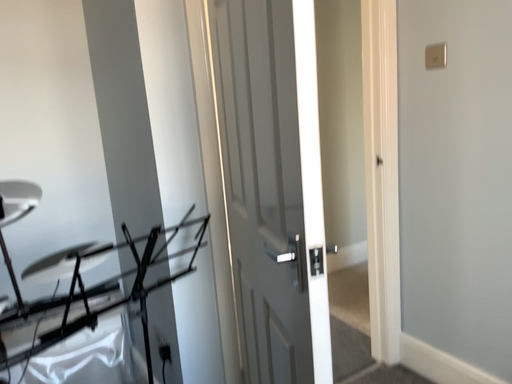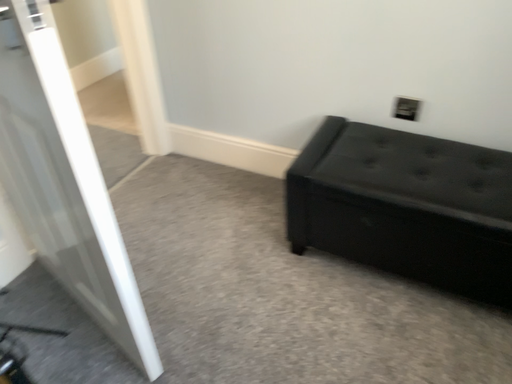
Question: Which way did the camera rotate in the video?

Choices:
 (A) rotated right
 (B) rotated left

Answer: (A)